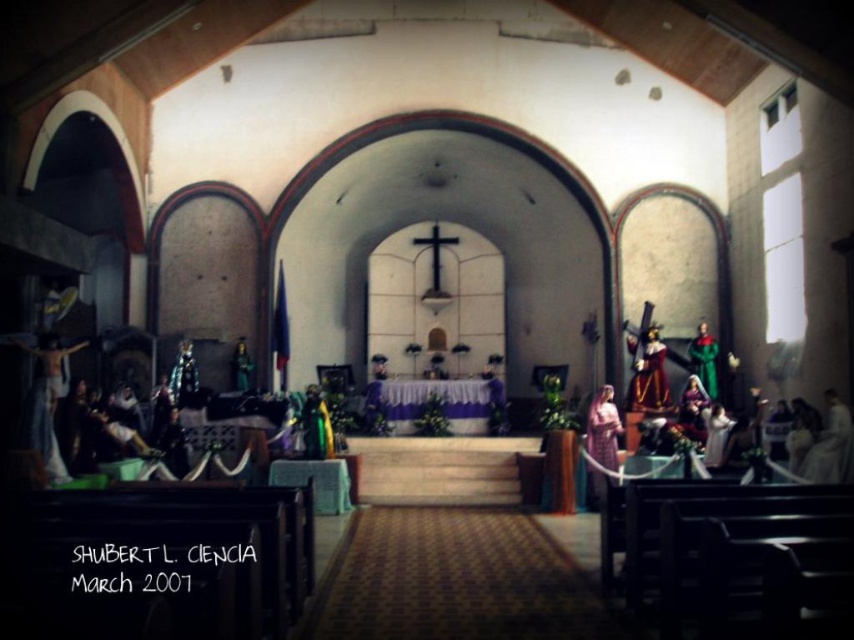
Question: Does matte wooden crucifix at left lie behind matte pink fabric at center?

Choices:
 (A) no
 (B) yes

Answer: (A)

Question: Does wooden statue at right appear over matte pink fabric at center?

Choices:
 (A) yes
 (B) no

Answer: (A)

Question: Estimate the real-world distances between objects in this image. Which object is farther from the matte pink fabric at center?

Choices:
 (A) white matte statue at right
 (B) wooden statue at right

Answer: (A)

Question: Is matte wooden crucifix at left thinner than wooden statue at right?

Choices:
 (A) yes
 (B) no

Answer: (B)

Question: Based on their relative distances, which object is nearer to the matte pink fabric at center?

Choices:
 (A) wooden statue at right
 (B) matte wooden crucifix at left
 (C) green fabric figure at right
 (D) white matte statue at right

Answer: (A)

Question: Based on their relative distances, which object is farther from the matte wooden crucifix at left?

Choices:
 (A) green fabric figure at right
 (B) matte pink fabric at center
 (C) wooden statue at right

Answer: (A)